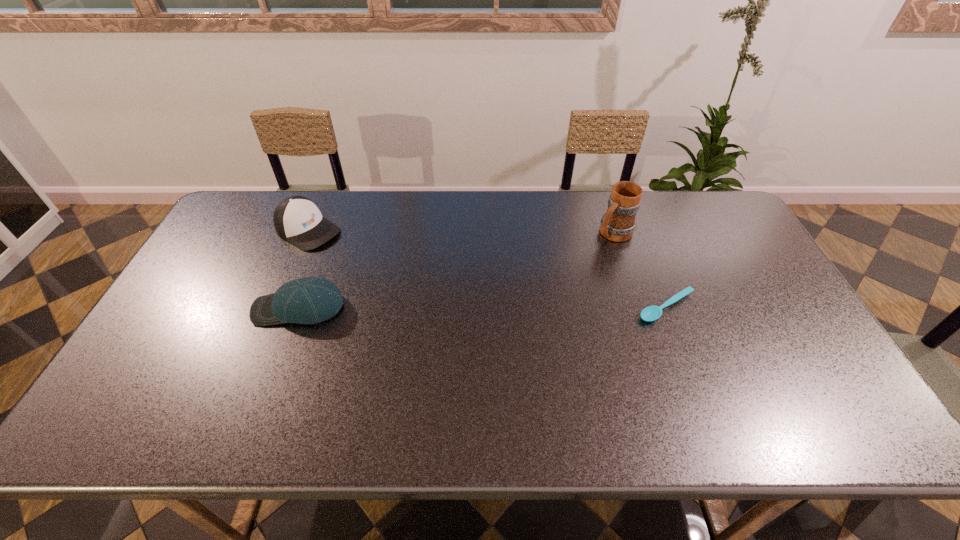
This screenshot has width=960, height=540. I want to click on vacant spot on the desktop that is between the second shortest object and the spoon and is positioned on the side of the tallest object with the handle, so click(x=524, y=307).

You are a GUI agent. You are given a task and a screenshot of the screen. Output one action in this format:
    pyautogui.click(x=<x>, y=<y>)
    Task: Click on the free space on the desktop that is between the second shortest object and the spoon and is positioned on the front panel of the cap
    
    Given the screenshot: What is the action you would take?
    pyautogui.click(x=435, y=307)